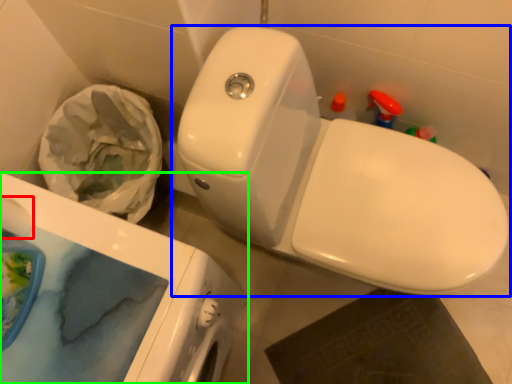
Question: Which object is positioned farthest from toilet paper (highlighted by a red box)? Select from toilet (highlighted by a blue box) and porcelain (highlighted by a green box).

Choices:
 (A) toilet
 (B) porcelain

Answer: (A)